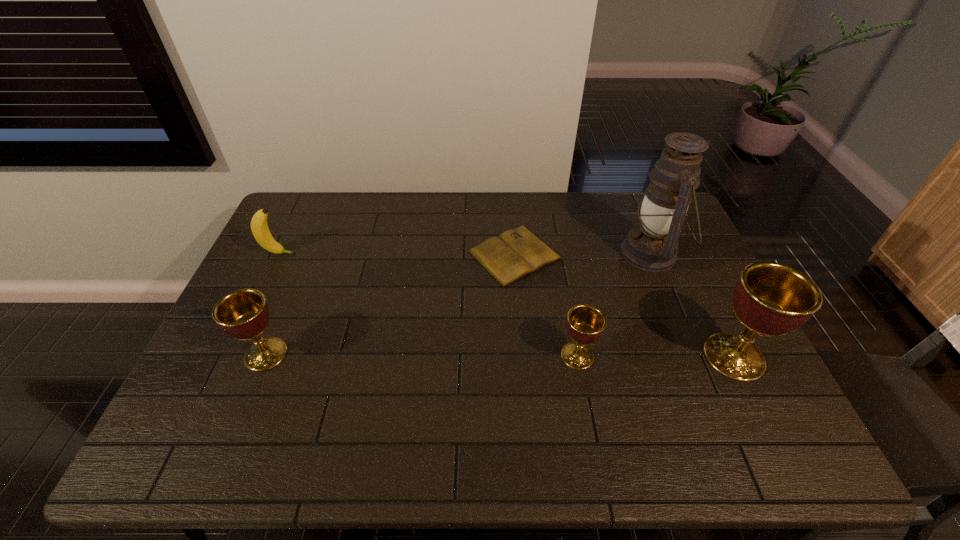
Where is `oil lamp that is at the right edge`? This screenshot has width=960, height=540. oil lamp that is at the right edge is located at coordinates (652, 246).

This screenshot has width=960, height=540. I want to click on object situated at the far right corner, so click(652, 246).

Identify the location of object situated at the near right corner. (770, 299).

Image resolution: width=960 pixels, height=540 pixels. In the image, there is a desktop. In order to click on vacant space at the far edge in this screenshot , I will do `click(539, 196)`.

Locate an element on the screen. free spot at the near edge of the desktop is located at coordinates (298, 392).

Locate an element on the screen. This screenshot has width=960, height=540. vacant region at the left edge is located at coordinates (262, 372).

Where is `free location at the right edge of the desktop`? This screenshot has width=960, height=540. free location at the right edge of the desktop is located at coordinates (713, 284).

Locate an element on the screen. This screenshot has width=960, height=540. vacant space at the near left corner of the desktop is located at coordinates (202, 389).

Find the location of a particular element. free space between the leftmost chalice and the book is located at coordinates (391, 305).

In order to click on free point between the banana and the tallest chalice in this screenshot , I will do 507,305.